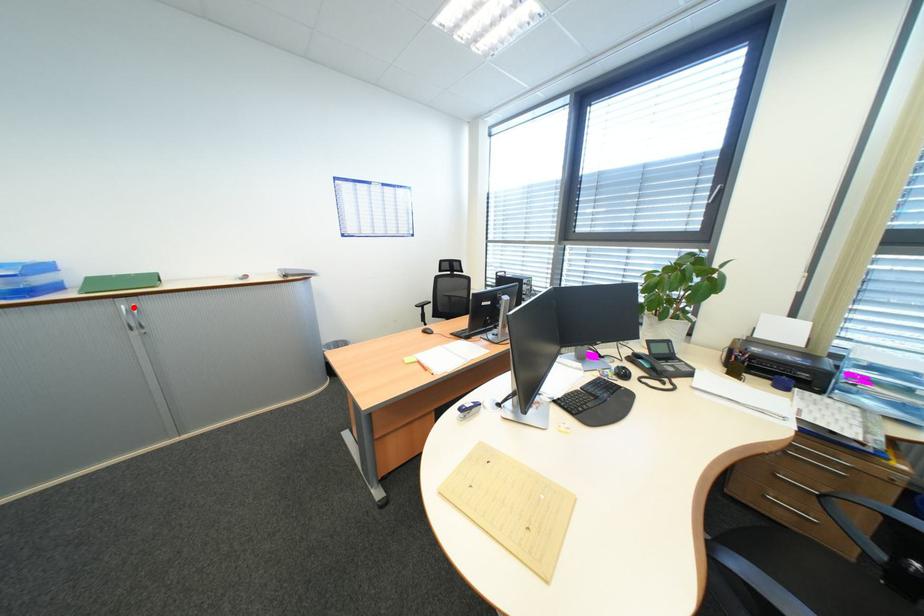
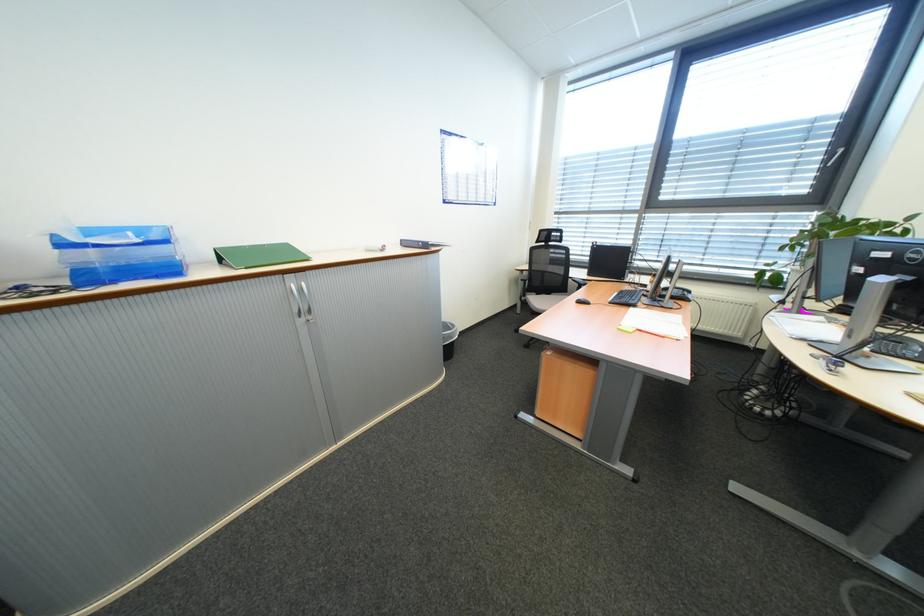
Find the pixel in the second image that matches the highlighted location in the first image.

(302, 286)